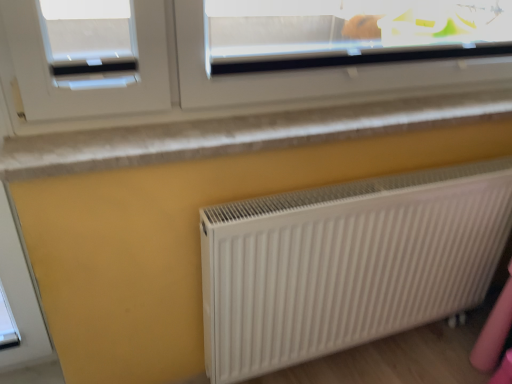
Question: From a real-world perspective, is white ribbed radiator at lower right on top of white textured window sill at upper center?

Choices:
 (A) no
 (B) yes

Answer: (A)

Question: Is white ribbed radiator at lower right thinner than white textured window sill at upper center?

Choices:
 (A) yes
 (B) no

Answer: (A)

Question: Is white ribbed radiator at lower right positioned beyond the bounds of white textured window sill at upper center?

Choices:
 (A) yes
 (B) no

Answer: (A)

Question: Is white ribbed radiator at lower right positioned far away from white textured window sill at upper center?

Choices:
 (A) yes
 (B) no

Answer: (B)

Question: Can you confirm if white ribbed radiator at lower right is positioned to the left of white textured window sill at upper center?

Choices:
 (A) no
 (B) yes

Answer: (A)

Question: Does white ribbed radiator at lower right touch white textured window sill at upper center?

Choices:
 (A) yes
 (B) no

Answer: (B)

Question: Is white textured window sill at upper center not within white ribbed radiator at lower right?

Choices:
 (A) yes
 (B) no

Answer: (A)

Question: Considering the relative sizes of white textured window sill at upper center and white ribbed radiator at lower right in the image provided, is white textured window sill at upper center wider than white ribbed radiator at lower right?

Choices:
 (A) yes
 (B) no

Answer: (A)

Question: Does white textured window sill at upper center have a greater height compared to white ribbed radiator at lower right?

Choices:
 (A) yes
 (B) no

Answer: (B)

Question: Is the surface of white textured window sill at upper center in direct contact with white ribbed radiator at lower right?

Choices:
 (A) yes
 (B) no

Answer: (B)

Question: Considering the relative sizes of white textured window sill at upper center and white ribbed radiator at lower right in the image provided, is white textured window sill at upper center thinner than white ribbed radiator at lower right?

Choices:
 (A) yes
 (B) no

Answer: (B)

Question: Does white textured window sill at upper center have a smaller size compared to white ribbed radiator at lower right?

Choices:
 (A) yes
 (B) no

Answer: (A)

Question: From a real-world perspective, is white ribbed radiator at lower right physically located above or below white textured window sill at upper center?

Choices:
 (A) below
 (B) above

Answer: (A)